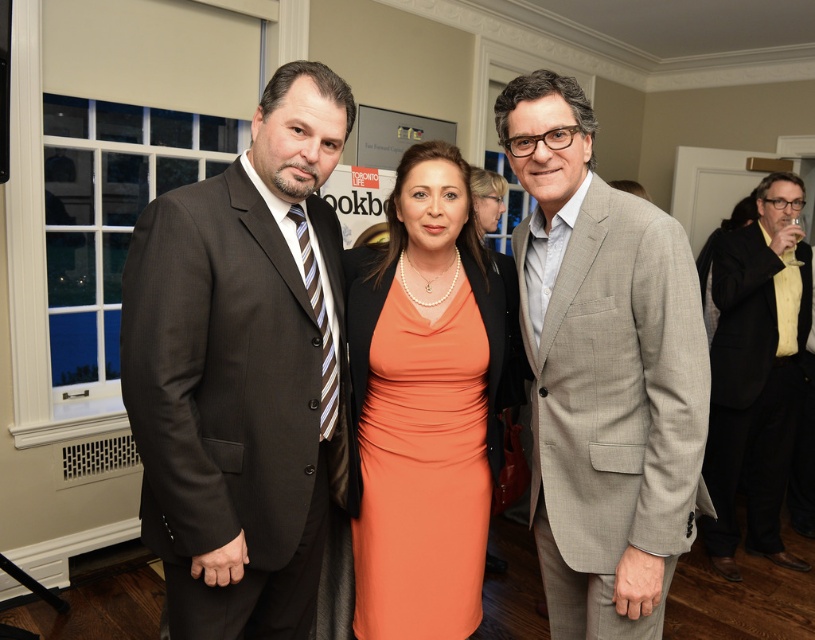
Can you confirm if dark brown suit at left is bigger than orange satin dress at center?

Correct, dark brown suit at left is larger in size than orange satin dress at center.

Is dark brown suit at left further to camera compared to orange satin dress at center?

No, it is not.

Between point (170, 232) and point (425, 625), which one is positioned in front?

Point (170, 232) is more forward.

The image size is (815, 640). Find the location of `dark brown suit at left`. dark brown suit at left is located at coordinates (243, 371).

Does gray textured suit at center have a larger size compared to orange satin dress at center?

Indeed, gray textured suit at center has a larger size compared to orange satin dress at center.

Between point (609, 618) and point (498, 330), which one is positioned behind?

The point (498, 330) is behind.

In order to click on gray textured suit at center in this screenshot , I will do `click(602, 372)`.

Image resolution: width=815 pixels, height=640 pixels. What are the coordinates of `gray textured suit at center` in the screenshot? It's located at 602,372.

Which is behind, point (465, 449) or point (761, 547)?

The point (761, 547) is more distant.

Can you confirm if orange satin dress at center is smaller than black textured suit at right?

Yes.

Locate an element on the screen. The image size is (815, 640). orange satin dress at center is located at coordinates (419, 461).